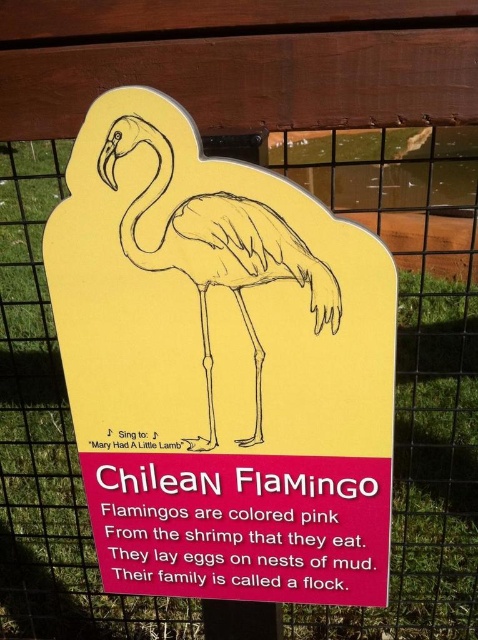
You are a visitor at a zoo and notice the yellow cardboard sign at center and the pink paper flamingo at center. Which object is taller?

The yellow cardboard sign at center is much taller than the pink paper flamingo at center.

You are a visitor at a zoo and see the yellow cardboard sign at center and the pink paper flamingo at center. Which object is positioned higher up in the image?

The pink paper flamingo at center is positioned higher up in the image because the yellow cardboard sign at center is below it.

You are standing in front of the educational signboard about Chilean Flamingos. You notice two points marked on the signboard at coordinates point (286,596) and point (239,216). If you want to touch the point that is closer to you, which coordinate should you choose?

Point (239,216) is closer to you because it is less further than point (286,596).